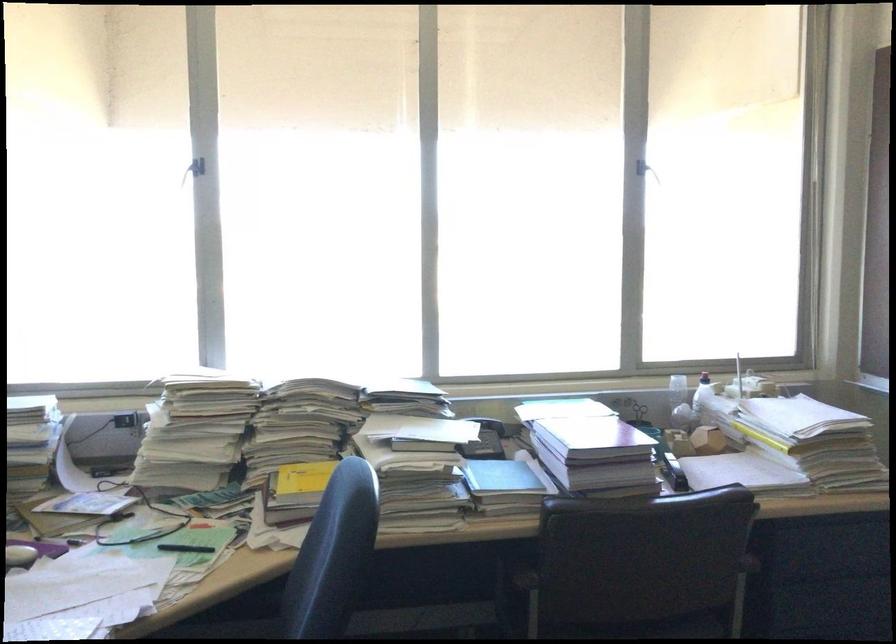
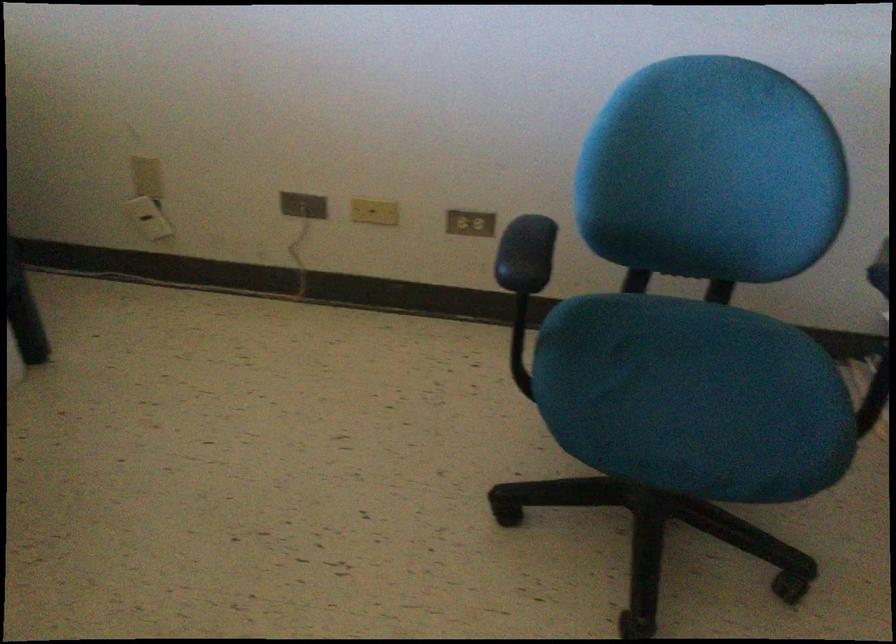
How did the camera likely rotate?

The camera's rotation is toward right-down.